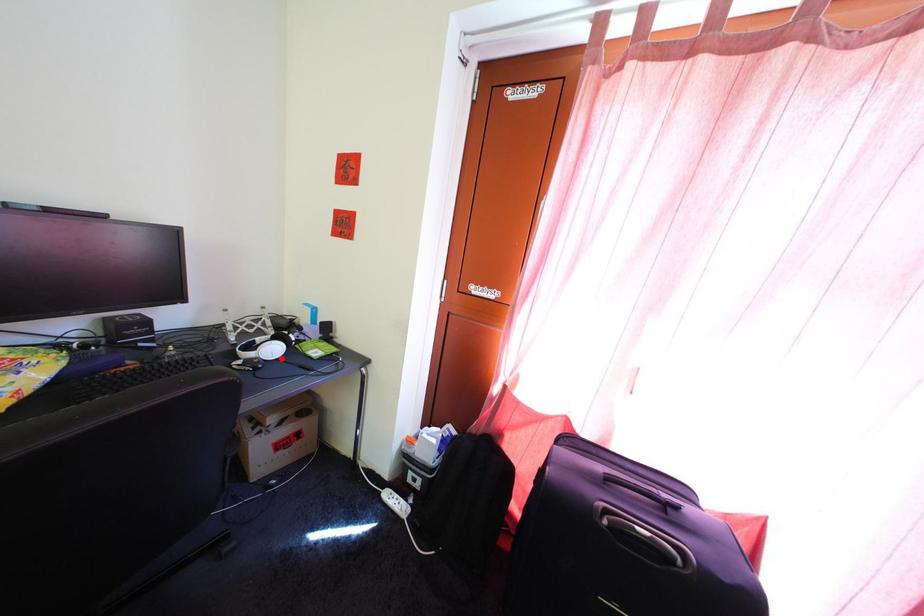
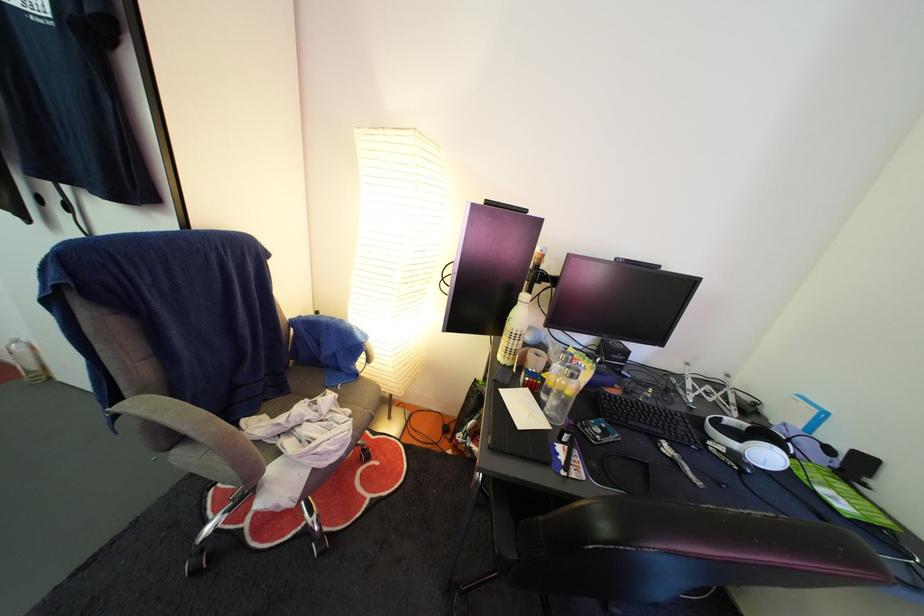
In the second image, find the point that corresponds to the highlighted location in the first image.

(774, 464)